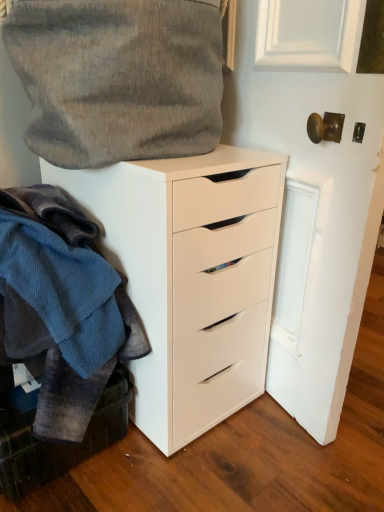
At what (x,y) coordinates should I click in order to perform the action: click on textured gray fabric at upper left. Please return your answer as a coordinate pair (x, y). This screenshot has height=512, width=384. Looking at the image, I should click on (117, 78).

Measure the distance between knitted wool sweater at left and camera.

knitted wool sweater at left and camera are 32.80 inches apart from each other.

What do you see at coordinates (191, 277) in the screenshot? The image size is (384, 512). I see `white matte chest of drawers at center` at bounding box center [191, 277].

Identify the location of textured gray fabric at upper left. The width and height of the screenshot is (384, 512). (117, 78).

From the image's perspective, is white matte chest of drawers at center above knitted wool sweater at left?

Correct, white matte chest of drawers at center appears higher than knitted wool sweater at left in the image.

How different are the orientations of white matte chest of drawers at center and knitted wool sweater at left in degrees?

1.85 degrees.

Does white matte chest of drawers at center come behind knitted wool sweater at left?

Yes, white matte chest of drawers at center is further from the viewer.

Is white matte chest of drawers at center surrounding knitted wool sweater at left?

No, knitted wool sweater at left is not a part of white matte chest of drawers at center.

Identify the location of clothing that appears on the right of white matte cabinet at lower left. (62, 307).

Which of these two, white matte cabinet at lower left or knitted wool sweater at left, is wider?

knitted wool sweater at left is wider.

How far apart are white matte cabinet at lower left and knitted wool sweater at left?

white matte cabinet at lower left and knitted wool sweater at left are 17.74 centimeters apart from each other.

From the image's perspective, would you say white matte chest of drawers at center is shown under textured gray fabric at upper left?

Correct, white matte chest of drawers at center appears lower than textured gray fabric at upper left in the image.

Measure the distance from white matte chest of drawers at center to textured gray fabric at upper left.

white matte chest of drawers at center and textured gray fabric at upper left are 25.58 centimeters apart.

At what (x,y) coordinates should I click in order to perform the action: click on chest of drawers lying on the right of textured gray fabric at upper left. Please return your answer as a coordinate pair (x, y). This screenshot has width=384, height=512. Looking at the image, I should click on (191, 277).

Considering the relative sizes of white matte chest of drawers at center and textured gray fabric at upper left in the image provided, is white matte chest of drawers at center taller than textured gray fabric at upper left?

Correct, white matte chest of drawers at center is much taller as textured gray fabric at upper left.

From the image's perspective, is white matte chest of drawers at center located above white matte cabinet at lower left?

Yes.

From a real-world perspective, is white matte chest of drawers at center over white matte cabinet at lower left?

Yes.

Between white matte chest of drawers at center and white matte cabinet at lower left, which one appears on the right side from the viewer's perspective?

white matte chest of drawers at center is more to the right.

Does point (42, 475) come in front of point (188, 211)?

No, (42, 475) is behind (188, 211).

Is white matte cabinet at lower left to the left of white matte chest of drawers at center from the viewer's perspective?

Indeed, white matte cabinet at lower left is positioned on the left side of white matte chest of drawers at center.

From the image's perspective, is white matte cabinet at lower left above white matte chest of drawers at center?

No, from the image's perspective, white matte cabinet at lower left is not on top of white matte chest of drawers at center.

I want to click on cabinetry on the left of white matte chest of drawers at center, so click(x=57, y=444).

Is textured gray fabric at upper left in front of or behind white matte chest of drawers at center in the image?

In the image, textured gray fabric at upper left appears in front of white matte chest of drawers at center.

Is textured gray fabric at upper left directly adjacent to white matte chest of drawers at center?

There is a gap between textured gray fabric at upper left and white matte chest of drawers at center.

Looking at the image, does textured gray fabric at upper left seem bigger or smaller compared to white matte chest of drawers at center?

textured gray fabric at upper left is smaller than white matte chest of drawers at center.

Which is more to the right, textured gray fabric at upper left or white matte chest of drawers at center?

Positioned to the right is white matte chest of drawers at center.

Can you confirm if textured gray fabric at upper left is thinner than white matte cabinet at lower left?

Indeed, textured gray fabric at upper left has a lesser width compared to white matte cabinet at lower left.

From the image's perspective, is textured gray fabric at upper left below white matte cabinet at lower left?

No, from the image's perspective, textured gray fabric at upper left is not beneath white matte cabinet at lower left.

How distant is textured gray fabric at upper left from white matte cabinet at lower left?

They are 25.42 inches apart.

Find the location of a particular element. The width and height of the screenshot is (384, 512). clothing that is below the white matte chest of drawers at center (from the image's perspective) is located at coordinates (62, 307).

Locate an element on the screen. Image resolution: width=384 pixels, height=512 pixels. cabinetry beneath the knitted wool sweater at left (from a real-world perspective) is located at coordinates (57, 444).

Considering their positions, is knitted wool sweater at left positioned further to textured gray fabric at upper left than white matte cabinet at lower left?

white matte cabinet at lower left is further to textured gray fabric at upper left.

Looking at the image, which one is located further to knitted wool sweater at left, textured gray fabric at upper left or white matte cabinet at lower left?

Based on the image, textured gray fabric at upper left appears to be further to knitted wool sweater at left.

From the image, which object appears to be nearer to white matte chest of drawers at center, textured gray fabric at upper left or white matte cabinet at lower left?

textured gray fabric at upper left lies closer to white matte chest of drawers at center than the other object.

From the image, which object appears to be nearer to knitted wool sweater at left, white matte chest of drawers at center or textured gray fabric at upper left?

white matte chest of drawers at center lies closer to knitted wool sweater at left than the other object.

Looking at the image, which one is located closer to white matte cabinet at lower left, textured gray fabric at upper left or white matte chest of drawers at center?

Among the two, white matte chest of drawers at center is located nearer to white matte cabinet at lower left.

Estimate the real-world distances between objects in this image. Which object is closer to knitted wool sweater at left, white matte chest of drawers at center or white matte cabinet at lower left?

The object closer to knitted wool sweater at left is white matte cabinet at lower left.

Considering their positions, is knitted wool sweater at left positioned closer to white matte chest of drawers at center than white matte cabinet at lower left?

knitted wool sweater at left is positioned closer to the anchor white matte chest of drawers at center.

Considering their positions, is knitted wool sweater at left positioned closer to white matte cabinet at lower left than textured gray fabric at upper left?

Based on the image, knitted wool sweater at left appears to be nearer to white matte cabinet at lower left.

Where is `the chest of drawers between textured gray fabric at upper left and white matte cabinet at lower left vertically`? The height and width of the screenshot is (512, 384). the chest of drawers between textured gray fabric at upper left and white matte cabinet at lower left vertically is located at coordinates (191, 277).

In order to click on the chest of drawers that lies between textured gray fabric at upper left and knitted wool sweater at left from top to bottom in this screenshot , I will do `click(191, 277)`.

In order to click on clothing between textured gray fabric at upper left and white matte cabinet at lower left from top to bottom in this screenshot , I will do 62,307.

What are the coordinates of `clothing between white matte chest of drawers at center and white matte cabinet at lower left in the vertical direction` in the screenshot? It's located at (62, 307).